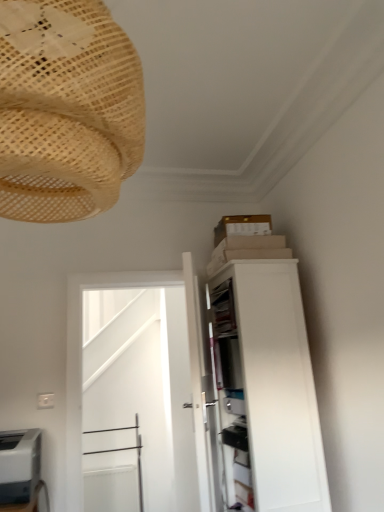
Question: Would you say gray matte printer at lower left is to the left or to the right of white matte cabinet at upper right in the picture?

Choices:
 (A) left
 (B) right

Answer: (A)

Question: In terms of width, does gray matte printer at lower left look wider or thinner when compared to white matte cabinet at upper right?

Choices:
 (A) wide
 (B) thin

Answer: (A)

Question: Which object is positioned farthest from the white glossy door at center?

Choices:
 (A) natural woven lampshade at upper left
 (B) gray matte printer at lower left
 (C) white matte cabinet at upper right

Answer: (A)

Question: Estimate the real-world distances between objects in this image. Which object is closer to the gray matte printer at lower left?

Choices:
 (A) white glossy door at center
 (B) white matte cabinet at upper right
 (C) natural woven lampshade at upper left

Answer: (B)